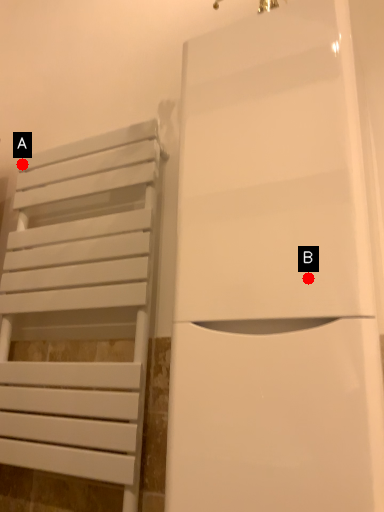
Question: Two points are circled on the image, labeled by A and B beside each circle. Among these points, which one is nearest to the camera?

Choices:
 (A) A is closer
 (B) B is closer

Answer: (B)